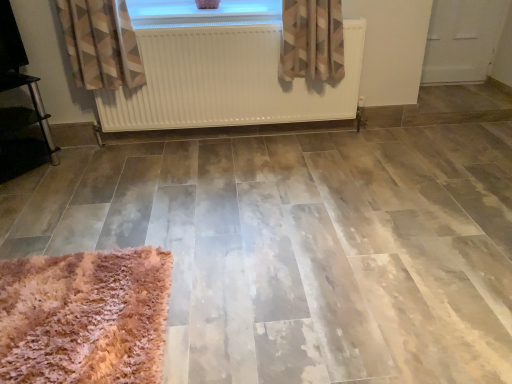
Question: Can you confirm if fuzzy pink rug at lower left is wider than white matte radiator at upper center?

Choices:
 (A) no
 (B) yes

Answer: (B)

Question: Is fuzzy pink rug at lower left to the right of white matte radiator at upper center from the viewer's perspective?

Choices:
 (A) no
 (B) yes

Answer: (A)

Question: Is fuzzy pink rug at lower left in contact with white matte radiator at upper center?

Choices:
 (A) no
 (B) yes

Answer: (A)

Question: Considering the relative sizes of fuzzy pink rug at lower left and white matte radiator at upper center in the image provided, is fuzzy pink rug at lower left smaller than white matte radiator at upper center?

Choices:
 (A) no
 (B) yes

Answer: (B)

Question: From the image's perspective, is fuzzy pink rug at lower left below white matte radiator at upper center?

Choices:
 (A) no
 (B) yes

Answer: (B)

Question: Is fuzzy pink rug at lower left at the left side of white matte radiator at upper center?

Choices:
 (A) no
 (B) yes

Answer: (B)

Question: Is transparent glass window at upper center next to white matte radiator at upper center?

Choices:
 (A) no
 (B) yes

Answer: (A)

Question: Considering the relative sizes of transparent glass window at upper center and white matte radiator at upper center in the image provided, is transparent glass window at upper center shorter than white matte radiator at upper center?

Choices:
 (A) yes
 (B) no

Answer: (A)

Question: Does transparent glass window at upper center have a greater height compared to white matte radiator at upper center?

Choices:
 (A) no
 (B) yes

Answer: (A)

Question: From the image's perspective, is transparent glass window at upper center on top of white matte radiator at upper center?

Choices:
 (A) no
 (B) yes

Answer: (B)

Question: Could you tell me if transparent glass window at upper center is turned towards white matte radiator at upper center?

Choices:
 (A) yes
 (B) no

Answer: (A)

Question: Considering the relative positions of transparent glass window at upper center and white matte radiator at upper center in the image provided, is transparent glass window at upper center in front of white matte radiator at upper center?

Choices:
 (A) yes
 (B) no

Answer: (B)

Question: Would you say transparent glass window at upper center is outside fuzzy pink rug at lower left?

Choices:
 (A) no
 (B) yes

Answer: (B)